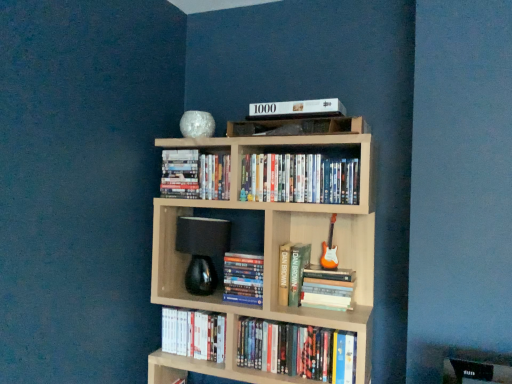
Find the location of `free space above matte plastic dvds at upper center, arranged as the 3th book when viewed from the top (from a real-world perspective)`. free space above matte plastic dvds at upper center, arranged as the 3th book when viewed from the top (from a real-world perspective) is located at coordinates (300, 150).